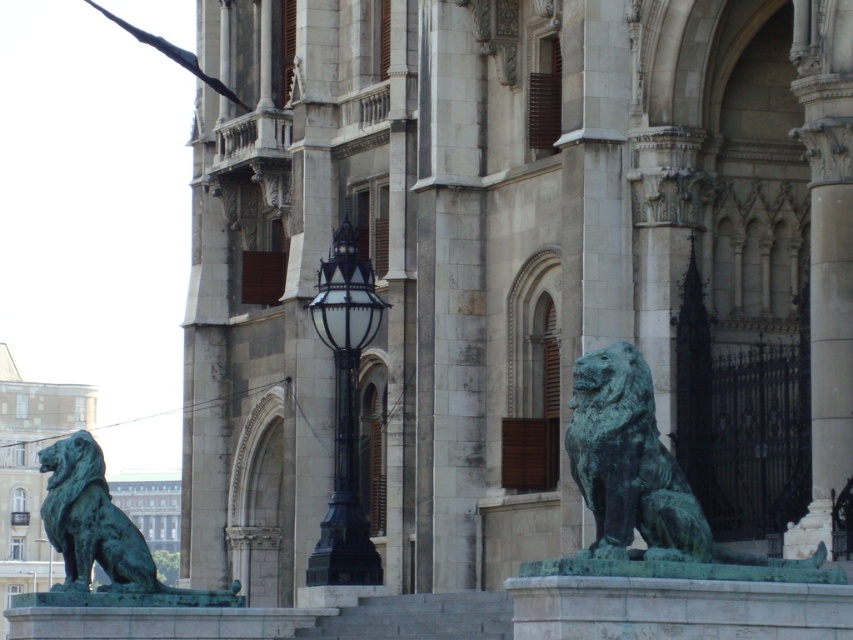
You are standing at the base of the grand building and see the two green patina lions. Which lion is closer to you, the green patina stone lion at lower left or the green patina lion at left?

The green patina stone lion at lower left is closer to you because it is further to the viewer than the green patina lion at left.

You are standing at the entrance of the grand historic building and want to take a photo of the green patina stone lion at lower left. According to the image coordinates, where exactly should you aim your camera to capture the lion?

You should aim your camera at the coordinates point (492, 253) to capture the green patina stone lion at lower left as specified in the image.